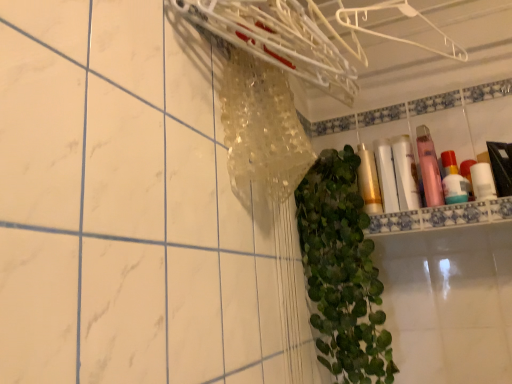
Question: From the image's perspective, is white plastic hanger at upper center, which is counted as the second hanger, starting from the left, positioned above or below clear plastic hanger at upper center, the 1th hanger when ordered from left to right?

Choices:
 (A) below
 (B) above

Answer: (B)

Question: Does point (453, 44) appear closer or farther from the camera than point (293, 66)?

Choices:
 (A) farther
 (B) closer

Answer: (A)

Question: Which is nearer to the gold metallic lotion at center, which is counted as the 1th toiletry, starting from the left?

Choices:
 (A) pink matte bottle at upper right, the 5th toiletry viewed from the left
 (B) white glossy shelf at upper right
 (C) matte white tube at right, the 5th toiletry from the right
 (D) pink glossy lotion at upper right, which appears as the 4th toiletry when viewed from the left
 (E) green leafy plant at center

Answer: (C)

Question: Which object is positioned closest to the matte white tube at right, the 5th toiletry from the right?

Choices:
 (A) gold metallic lotion at center, acting as the 6th toiletry starting from the right
 (B) green leafy plant at center
 (C) white plastic hanger at upper center, which is counted as the second hanger, starting from the left
 (D) white glossy shelf at upper right
 (E) clear plastic hanger at upper center, the 1th hanger when ordered from left to right

Answer: (A)